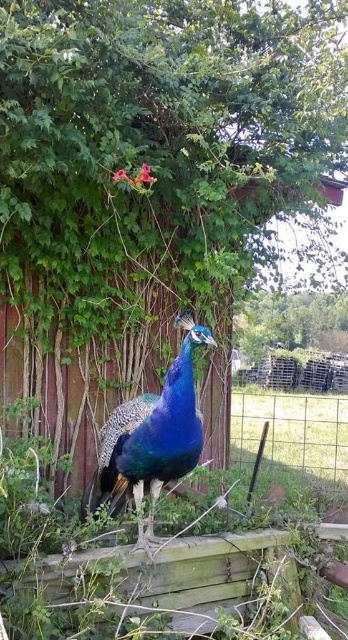
Question: Is shiny blue peacock at center to the right of wire mesh fence at lower right from the viewer's perspective?

Choices:
 (A) yes
 (B) no

Answer: (B)

Question: Which of the following is the closest to the observer?

Choices:
 (A) (124, 426)
 (B) (309, 440)

Answer: (A)

Question: Which object appears farthest from the camera in this image?

Choices:
 (A) shiny blue peacock at center
 (B) wire mesh fence at lower right

Answer: (B)

Question: Is shiny blue peacock at center smaller than wire mesh fence at lower right?

Choices:
 (A) yes
 (B) no

Answer: (A)

Question: Which point is closer to the camera?

Choices:
 (A) shiny blue peacock at center
 (B) wire mesh fence at lower right

Answer: (A)

Question: Where is shiny blue peacock at center located in relation to wire mesh fence at lower right in the image?

Choices:
 (A) right
 (B) left

Answer: (B)